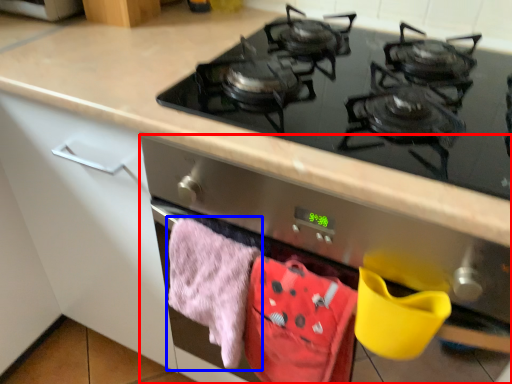
Question: Which object is further to the camera taking this photo, oven (highlighted by a red box) or beach towel (highlighted by a blue box)?

Choices:
 (A) oven
 (B) beach towel

Answer: (B)